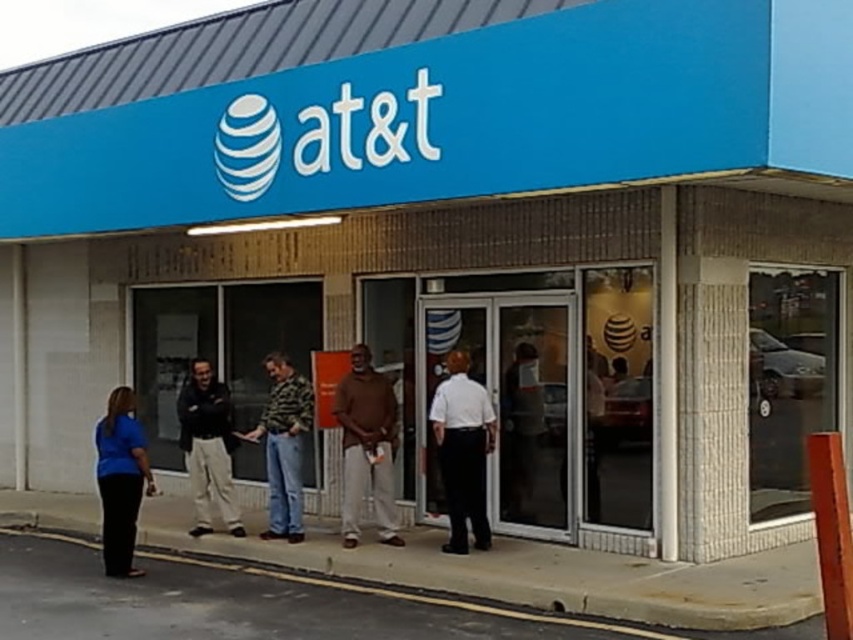
From the picture: You are a photographer trying to capture a group photo of the people outside the AT T store. You notice the white shirt at center and the black pants at lower left. Which of these two items has a smaller width in the current scene?

The white shirt at center has a lesser width compared to the black pants at lower left.